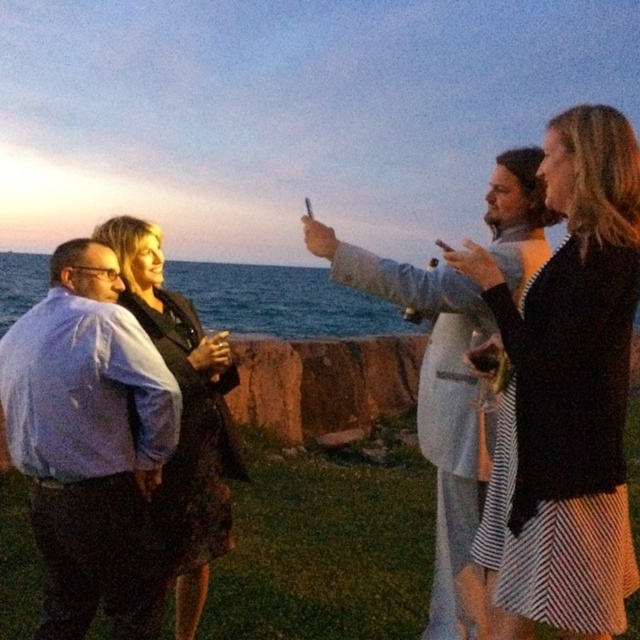
Question: From the image, what is the correct spatial relationship of light blue shirt at left in relation to matte gray phone at upper center?

Choices:
 (A) above
 (B) below

Answer: (B)

Question: Which object is the farthest from the black lace dress at center?

Choices:
 (A) matte gray phone at upper center
 (B) light blue shirt at left

Answer: (A)

Question: Can you confirm if light blue shirt at left is positioned below matte gray phone at upper center?

Choices:
 (A) no
 (B) yes

Answer: (B)

Question: Which point is closer to the camera?

Choices:
 (A) (45, 618)
 (B) (420, 636)
 (C) (576, 138)
 (D) (150, 252)

Answer: (C)

Question: Which object is positioned closest to the light blue shirt at left?

Choices:
 (A) black lace dress at center
 (B) black textured dress at center
 (C) matte gray phone at upper center

Answer: (A)

Question: Can you confirm if black textured dress at center is positioned above black lace dress at center?

Choices:
 (A) no
 (B) yes

Answer: (B)